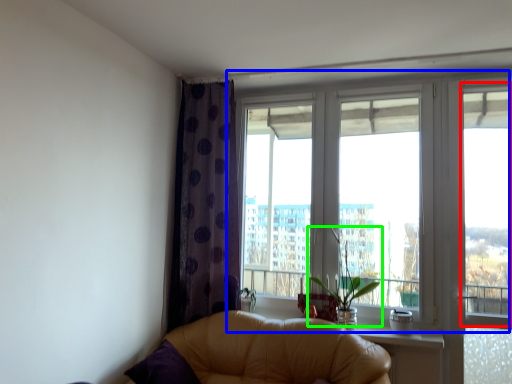
Question: Which is farther away from window screen (highlighted by a red box)? window (highlighted by a blue box) or plant (highlighted by a green box)?

Choices:
 (A) window
 (B) plant

Answer: (B)